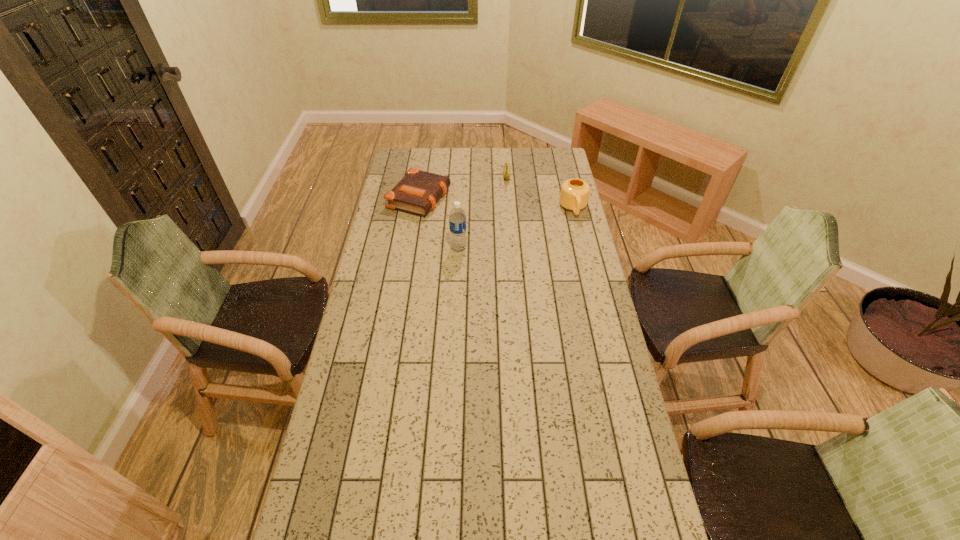
Locate an element on the screen. This screenshot has width=960, height=540. free space between the shortest object and the second tallest object is located at coordinates (496, 204).

The width and height of the screenshot is (960, 540). In order to click on unoccupied area between the mug and the nearest object in this screenshot , I will do `click(516, 228)`.

Locate an element on the screen. free spot between the shortest object and the rightmost object is located at coordinates (496, 204).

Identify the location of vacant area that lies between the water bottle and the mug. (516, 228).

The height and width of the screenshot is (540, 960). In order to click on vacant area between the shortest object and the second object from right to left in this screenshot , I will do `click(463, 186)`.

The width and height of the screenshot is (960, 540). What are the coordinates of `free spot between the rightmost object and the second shortest object` in the screenshot? It's located at (540, 191).

Identify the location of object that stands as the second closest to the third shortest object. (457, 218).

The height and width of the screenshot is (540, 960). I want to click on the third closest object to the second tallest object, so click(418, 191).

The width and height of the screenshot is (960, 540). Identify the location of vacant point that satisfies the following two spatial constraints: 1. on the back side of the tallest object; 2. on the left side of the third object from left to right. (463, 174).